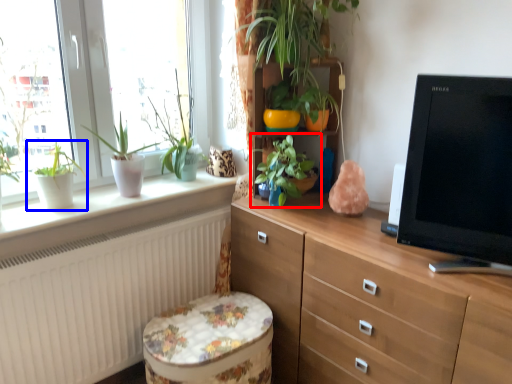
Question: Which object appears closest to the camera in this image, houseplant (highlighted by a red box) or houseplant (highlighted by a blue box)?

Choices:
 (A) houseplant
 (B) houseplant

Answer: (B)